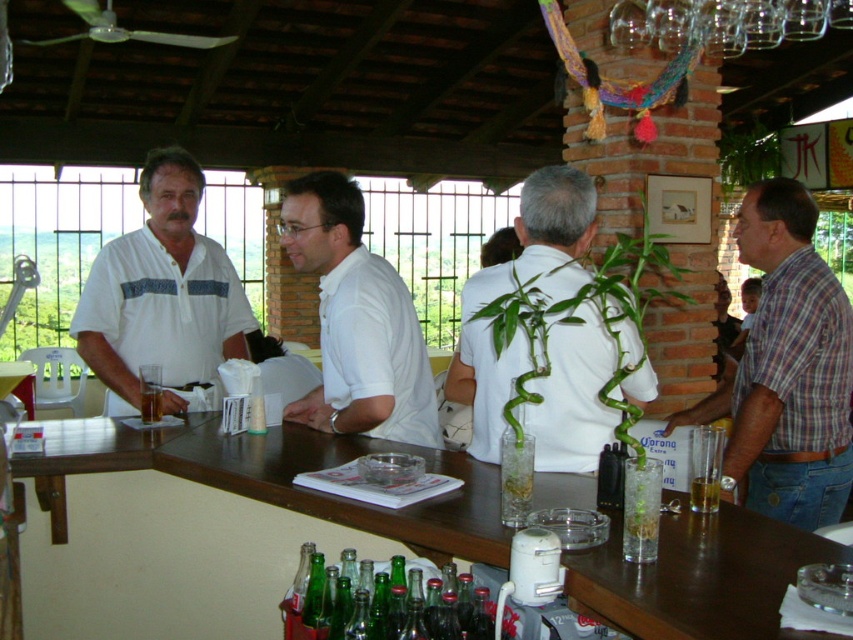
You are a bartender at the bar counter. You need to place a new drink order for the man with the white matte shirt at center. Where should you place the drink so it doesn not spill onto the white matte plant at center?

The white matte plant at center is positioned over the white matte shirt at center, so placing the drink directly on the bar counter to the side or below the white matte shirt at center would avoid spilling onto the plant.

Based on the photo, you are a bartender at the bar counter. You need to place a new drink order for the man in the white matte shirt at left. To reach him, you must walk around the white matte plant at center. Which direction should you go around the plant to approach him?

The white matte plant at center is to the right of the white matte shirt at left, so you should go around the plant to the left to approach the man in the white matte shirt at left.

From the picture: You are a bartender at the bar counter. You need to reach for the white matte plant at center to water it, but there is a customer wearing the white matte shirt at center sitting nearby. Can you easily access the plant without disturbing the customer?

The white matte plant at center is in front of the white matte shirt at center, so you can easily access the plant without disturbing the customer.